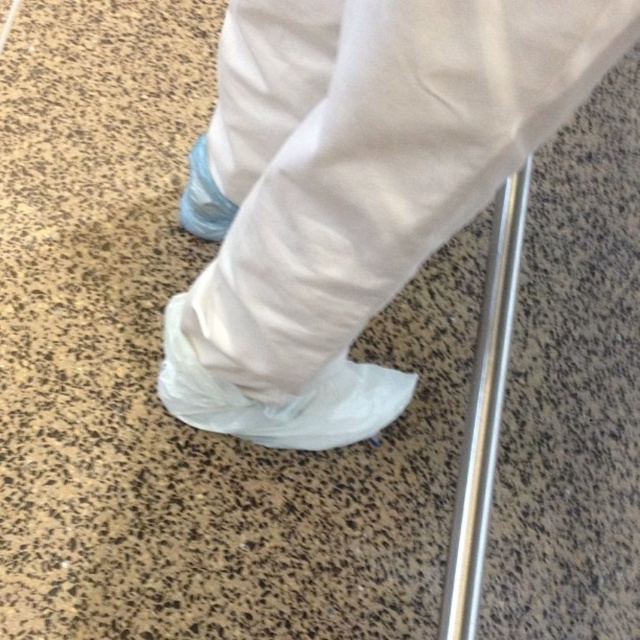
Question: Which object is closer to the camera taking this photo?

Choices:
 (A) silver metallic rail at center
 (B) white plastic boot at lower center

Answer: (B)

Question: Is white plastic shoe cover at lower center positioned before silver metallic rail at center?

Choices:
 (A) yes
 (B) no

Answer: (A)

Question: Is white plastic shoe cover at lower center to the right of blue fabric shoe at lower left from the viewer's perspective?

Choices:
 (A) yes
 (B) no

Answer: (A)

Question: Among these objects, which one is nearest to the camera?

Choices:
 (A) blue fabric shoe at lower left
 (B) silver metallic rail at center
 (C) white plastic shoe cover at lower center

Answer: (C)

Question: Which of these objects is positioned farthest from the silver metallic rail at center?

Choices:
 (A) blue fabric shoe at lower left
 (B) white plastic shoe cover at lower center

Answer: (A)

Question: Is white plastic boot at lower center thinner than silver metallic rail at center?

Choices:
 (A) no
 (B) yes

Answer: (A)